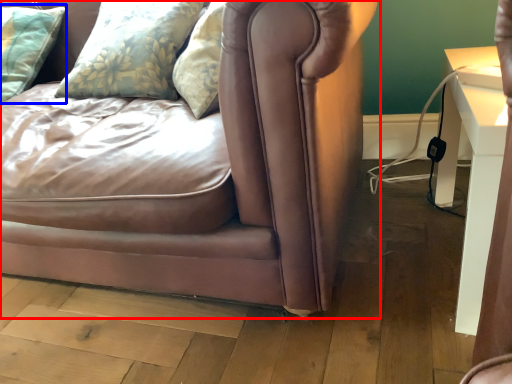
Question: Which of the following is the closest to the observer, studio couch (highlighted by a red box) or pillow (highlighted by a blue box)?

Choices:
 (A) studio couch
 (B) pillow

Answer: (A)